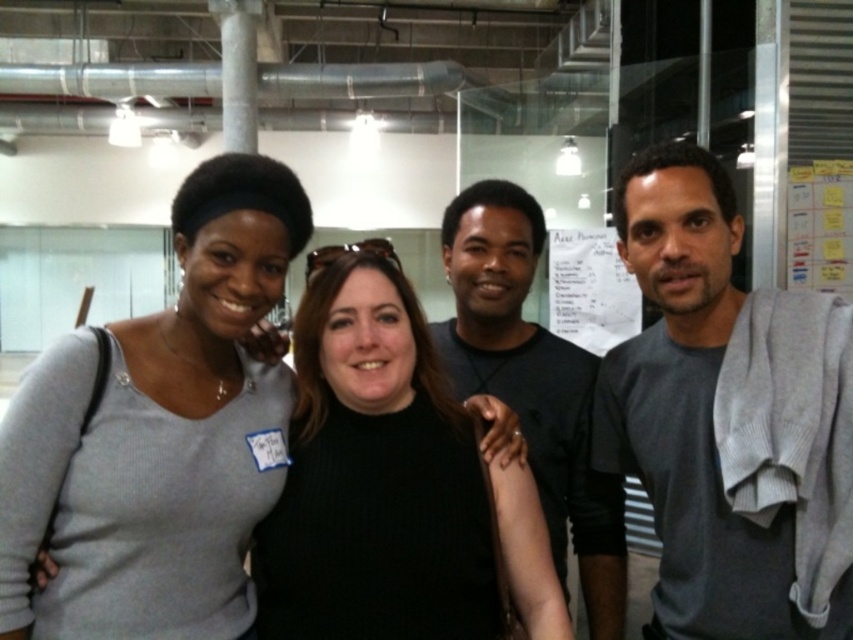
Is point (96, 552) positioned in front of point (453, 204)?

Yes, it is.

Is matte gray sweater at center to the left of dark gray shirt at center from the viewer's perspective?

Yes, matte gray sweater at center is to the left of dark gray shirt at center.

Between point (225, 518) and point (505, 212), which one is positioned in front?

Point (225, 518) is in front.

Where is `matte gray sweater at center`? Image resolution: width=853 pixels, height=640 pixels. matte gray sweater at center is located at coordinates (218, 285).

The width and height of the screenshot is (853, 640). What do you see at coordinates (729, 417) in the screenshot?
I see `gray cotton shirt at right` at bounding box center [729, 417].

Where is `gray cotton shirt at right`? The height and width of the screenshot is (640, 853). gray cotton shirt at right is located at coordinates (729, 417).

Is point (624, 364) farther from camera compared to point (541, 465)?

No, (624, 364) is in front of (541, 465).

This screenshot has height=640, width=853. I want to click on gray cotton shirt at right, so click(x=729, y=417).

Does gray cotton shirt at right appear on the left side of matte gray sweater at center?

Incorrect, gray cotton shirt at right is not on the left side of matte gray sweater at center.

Is gray cotton shirt at right to the right of matte gray sweater at center from the viewer's perspective?

Correct, you'll find gray cotton shirt at right to the right of matte gray sweater at center.

Is point (711, 163) positioned before point (140, 323)?

Yes, it is in front of point (140, 323).

At what (x,y) coordinates should I click in order to perform the action: click on gray cotton shirt at right. Please return your answer as a coordinate pair (x, y). Looking at the image, I should click on (729, 417).